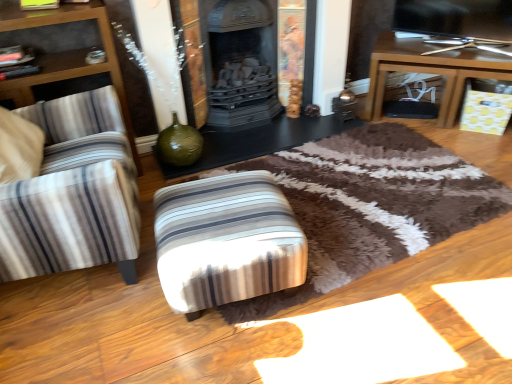
Question: Is the surface of striped fabric ottoman at left in direct contact with brown wooden table at right, positioned as the second table in left-to-right order?

Choices:
 (A) no
 (B) yes

Answer: (A)

Question: From a real-world perspective, is striped fabric ottoman at left located higher than brown wooden table at right, positioned as the second table in left-to-right order?

Choices:
 (A) yes
 (B) no

Answer: (A)

Question: Can you confirm if striped fabric ottoman at left is smaller than brown wooden table at right, acting as the 1th table starting from the right?

Choices:
 (A) no
 (B) yes

Answer: (A)

Question: Are striped fabric ottoman at left and brown wooden table at right, acting as the 1th table starting from the right, located far from each other?

Choices:
 (A) yes
 (B) no

Answer: (A)

Question: From the image's perspective, does striped fabric ottoman at left appear higher than brown wooden table at right, positioned as the second table in left-to-right order?

Choices:
 (A) yes
 (B) no

Answer: (B)

Question: Could you tell me if striped fabric ottoman at left is turned towards brown wooden table at right, acting as the 1th table starting from the right?

Choices:
 (A) no
 (B) yes

Answer: (B)

Question: Is striped fabric stool at center behind striped fabric ottoman at left?

Choices:
 (A) no
 (B) yes

Answer: (B)

Question: Is striped fabric stool at center looking in the opposite direction of striped fabric ottoman at left?

Choices:
 (A) yes
 (B) no

Answer: (A)

Question: Does striped fabric stool at center have a greater width compared to striped fabric ottoman at left?

Choices:
 (A) no
 (B) yes

Answer: (A)

Question: From a real-world perspective, is striped fabric stool at center positioned over striped fabric ottoman at left based on gravity?

Choices:
 (A) no
 (B) yes

Answer: (A)

Question: From the image's perspective, is striped fabric stool at center on top of striped fabric ottoman at left?

Choices:
 (A) no
 (B) yes

Answer: (A)

Question: Does striped fabric stool at center have a lesser width compared to striped fabric ottoman at left?

Choices:
 (A) no
 (B) yes

Answer: (B)

Question: Does brown wooden table at right, acting as the 1th table starting from the right, have a greater height compared to black glossy table at center, which ranks as the first table in left-to-right order?

Choices:
 (A) yes
 (B) no

Answer: (A)